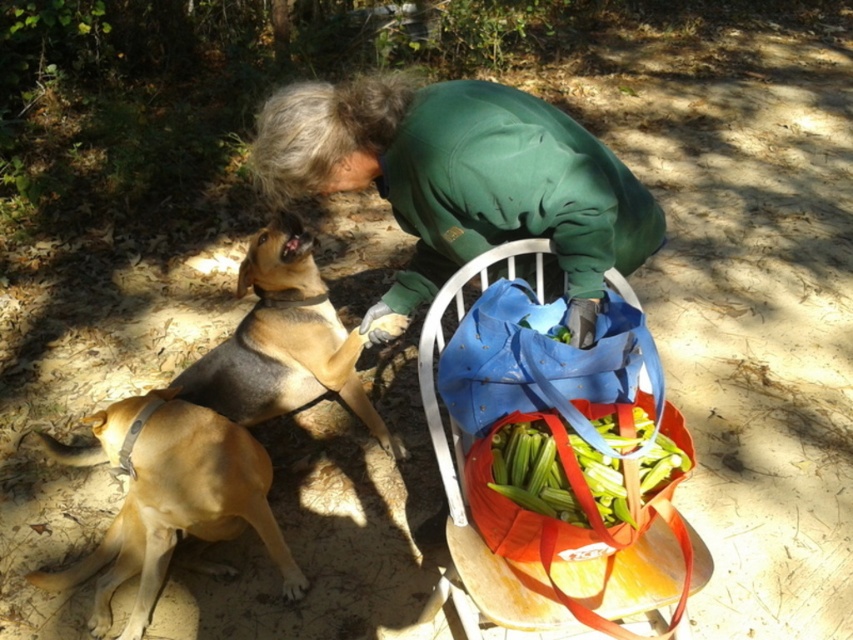
You are a delivery robot with a 40 cm wide package. You need to deliver it through the path between the green fleece jacket at center and the green leafy vegetables at lower center. Can you pass through?

The distance between the green fleece jacket at center and the green leafy vegetables at lower center is 39.60 centimeters. Since the package is 40 cm wide, it is slightly wider than the available space. Therefore, the robot cannot pass through the path between them.

You are standing at the camera position and want to pick up an object at point (409,116). Is the distance within your comfortable reaching range of 2 meters?

The distance of point (409,116) from camera is 1.73 meters, which is within your comfortable reaching range of 2 meters.